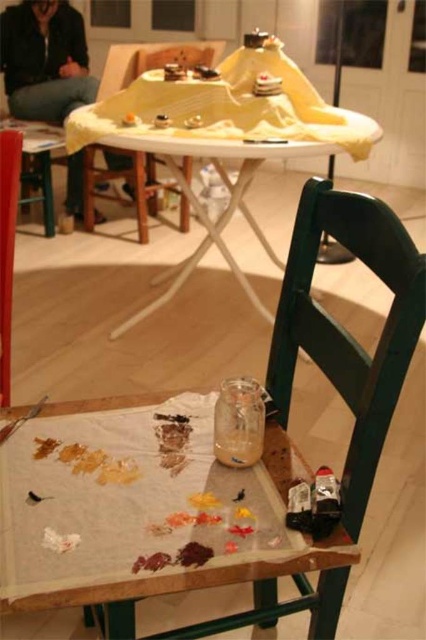
You are an artist who needs to hang a coat hanger on the wall. The coat hanger can only hold items up to the height of the green wooden chair at center. Can you hang the black leather jacket at upper left on it?

The black leather jacket at upper left is taller than the green wooden chair at center, so it cannot be hung on the coat hanger which can only hold items up to the height of the green wooden chair at center.

From the picture: You are an artist who needs to place a new canvas on the table. The canvas is 1 meter wide. Is there enough space between the black leather jacket at upper left and the edge of the table to place it?

The black leather jacket at upper left is located at point (45, 60), which is near the corner of the table. However, the exact dimensions of the table and the space available arenecessary to determine if the canvas will fit. Since this information isn provided, it is unclear if there is sufficient space.